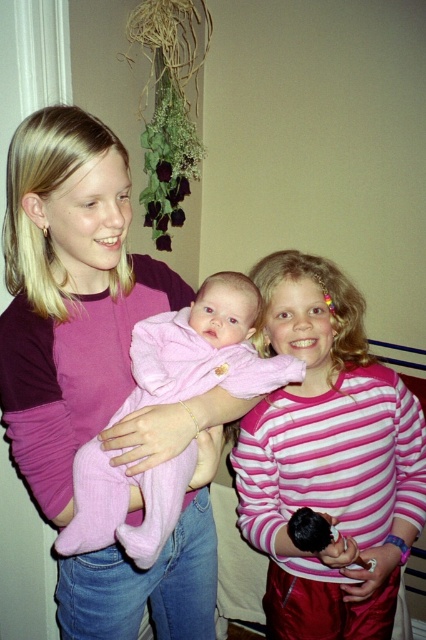
You are an interior designer analyzing the spatial layout of this indoor scene. The pink fabric baby at left is placed at coordinates 0.481, 0.183. If the room has a wall 1.5 meters away from that point, will the baby be within 1 meter of the wall?

The pink fabric baby at left is positioned at point (77,307). Since the wall is 1.5 meters away from that point, the baby is 1.5 meters away from the wall, which is more than 1 meter. Therefore, the baby is not within 1 meter of the wall.

You are taking a photo of the two points in the image. Which point, point (x=8, y=246) or point (x=278, y=400), will appear larger in the photo?

Point (x=8, y=246) is closer to the camera than point (x=278, y=400), so it will appear larger in the photo.

You are a photographer setting up a shot of the two girls and the baby. You need to ensure that the pink striped shirt at center and the pink soft fabric baby at center are both visible in the frame. Given their height difference, which one should you position closer to the camera to avoid one blocking the other?

The pink soft fabric baby at center is shorter than the pink striped shirt at center, so positioning the pink soft fabric baby at center closer to the camera would help ensure both are visible without one blocking the other.